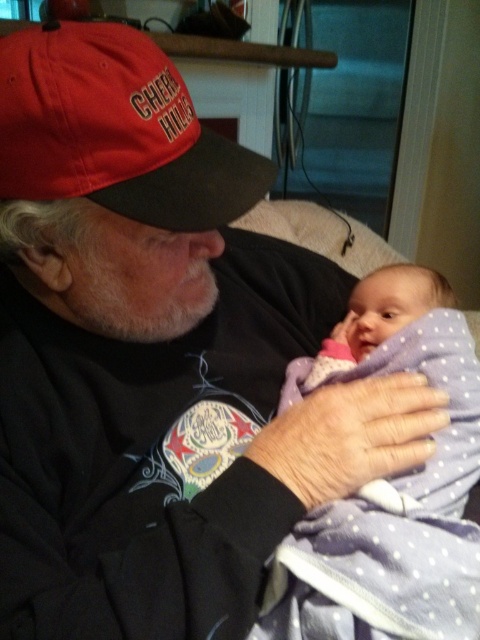
Looking at this image, you are a photographer setting up for a family portrait. You notice the purple polka dot blanket at center and the red matte baseball cap at upper left in the scene. Based on their positions, which object is closer to the camera?

The red matte baseball cap at upper left is closer to the camera because it is positioned above the purple polka dot blanket at center, which is located below it.

You are a photographer trying to capture a closeup of the purple polka dot blanket at center and the red matte baseball cap at upper left in the scene. Your camera can only focus on objects within a 10 inch range. Can you fit both objects in the same frame without moving the camera?

The purple polka dot blanket at center and the red matte baseball cap at upper left are 12.40 inches apart, which exceeds the camera focus range of 10 inches. Therefore, you cannot fit both objects in the same frame without moving the camera.

You are a photographer trying to capture a closeup of the red matte baseball cap at upper left and the purple polka dot blanket at center. Since you can only focus on one object at a time, which object should you focus on first to ensure the other is still in the frame?

The photographer should focus on the red matte baseball cap at upper left first because the purple polka dot blanket at center is to the right of it, so both will remain in the frame if starting with the leftmost object.